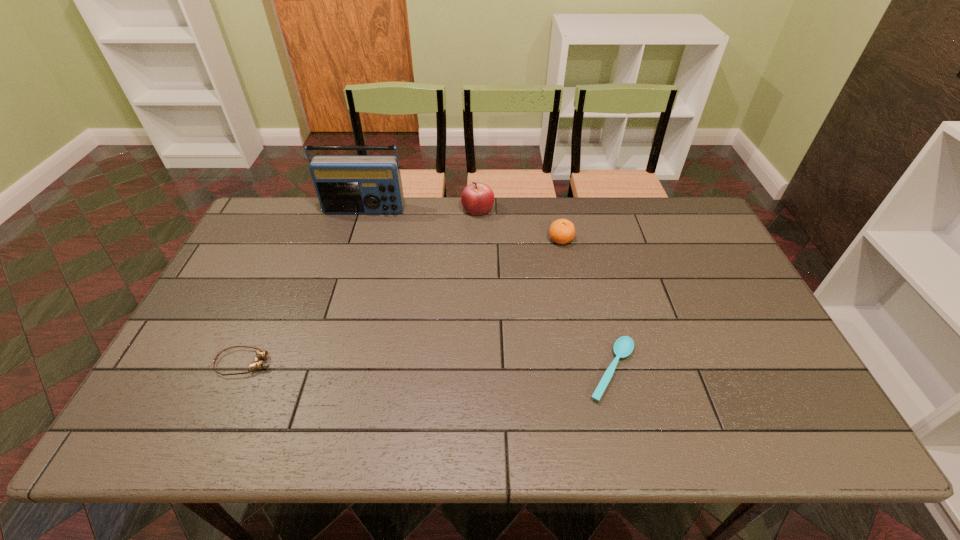
Find the location of `free space that is in between the shortest object and the radio receiver`. free space that is in between the shortest object and the radio receiver is located at coordinates (488, 291).

Identify the location of empty location between the spoon and the third object from left to right. (544, 290).

Find the location of a particular element. Image resolution: width=960 pixels, height=540 pixels. object that is the third nearest to the radio receiver is located at coordinates (260, 354).

I want to click on object that is the third closest to the tallest object, so click(x=260, y=354).

The image size is (960, 540). Find the location of `vacant region that satisfies the following two spatial constraints: 1. on the front lenses and sides of the second shortest object; 2. on the left side of the shortest object`. vacant region that satisfies the following two spatial constraints: 1. on the front lenses and sides of the second shortest object; 2. on the left side of the shortest object is located at coordinates (x=241, y=370).

Locate an element on the screen. free space that satisfies the following two spatial constraints: 1. on the front side of the second tallest object; 2. on the front lenses and sides of the goggles is located at coordinates (477, 363).

The image size is (960, 540). I want to click on vacant area in the image that satisfies the following two spatial constraints: 1. on the front side of the third farthest object; 2. on the left side of the second tallest object, so click(x=477, y=239).

Identify the location of vacant space that satisfies the following two spatial constraints: 1. on the front side of the clementine; 2. on the left side of the third object from right to left. (477, 239).

This screenshot has width=960, height=540. Find the location of `blank space that satisfies the following two spatial constraints: 1. on the front panel of the shortest object; 2. on the left side of the radio receiver`. blank space that satisfies the following two spatial constraints: 1. on the front panel of the shortest object; 2. on the left side of the radio receiver is located at coordinates (315, 370).

Identify the location of blank space that satisfies the following two spatial constraints: 1. on the front side of the shortest object; 2. on the right side of the third shortest object. This screenshot has width=960, height=540. (587, 370).